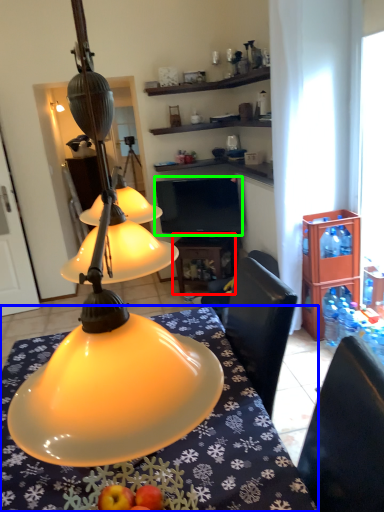
Question: Based on their relative distances, which object is nearer to table (highlighted by a red box)? Choose from desk (highlighted by a blue box) and television (highlighted by a green box).

Choices:
 (A) desk
 (B) television

Answer: (B)